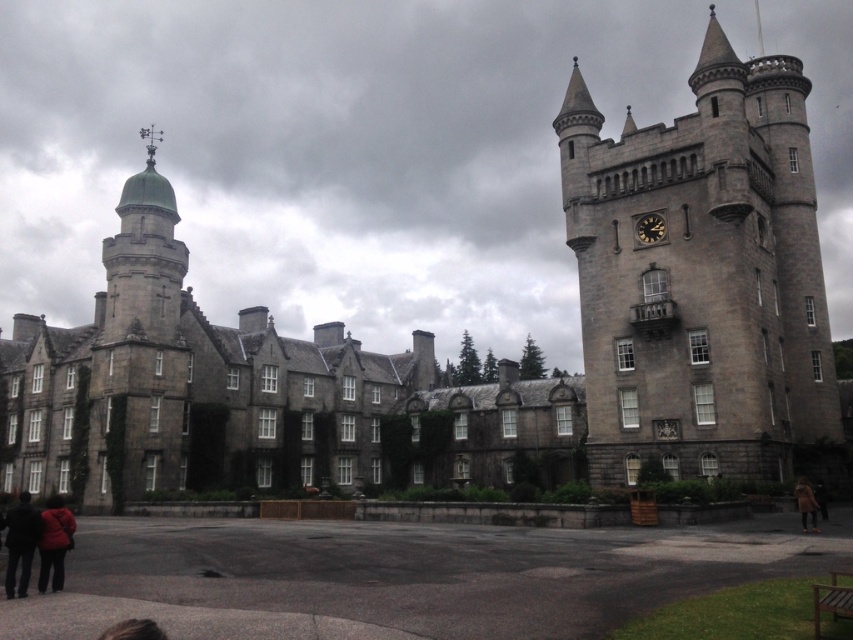
Who is taller, dark fabric jacket at lower left or brown fuzzy coat at lower right?

dark fabric jacket at lower left

Is dark fabric jacket at lower left closer to camera compared to brown fuzzy coat at lower right?

Yes, it is.

Image resolution: width=853 pixels, height=640 pixels. I want to click on dark fabric jacket at lower left, so click(20, 544).

Where is `dark fabric jacket at lower left`? The height and width of the screenshot is (640, 853). dark fabric jacket at lower left is located at coordinates (20, 544).

Which of these two, dark gray stone tower at right or brown fuzzy coat at lower right, stands shorter?

brown fuzzy coat at lower right

Consider the image. Is dark gray stone tower at right shorter than brown fuzzy coat at lower right?

In fact, dark gray stone tower at right may be taller than brown fuzzy coat at lower right.

This screenshot has height=640, width=853. What do you see at coordinates (701, 278) in the screenshot?
I see `dark gray stone tower at right` at bounding box center [701, 278].

The width and height of the screenshot is (853, 640). Identify the location of dark gray stone tower at right. (701, 278).

Is matte red coat at lower left bigger than brown fuzzy coat at lower right?

Correct, matte red coat at lower left is larger in size than brown fuzzy coat at lower right.

Based on the photo, is matte red coat at lower left above brown fuzzy coat at lower right?

Actually, matte red coat at lower left is below brown fuzzy coat at lower right.

Identify the location of matte red coat at lower left. (54, 541).